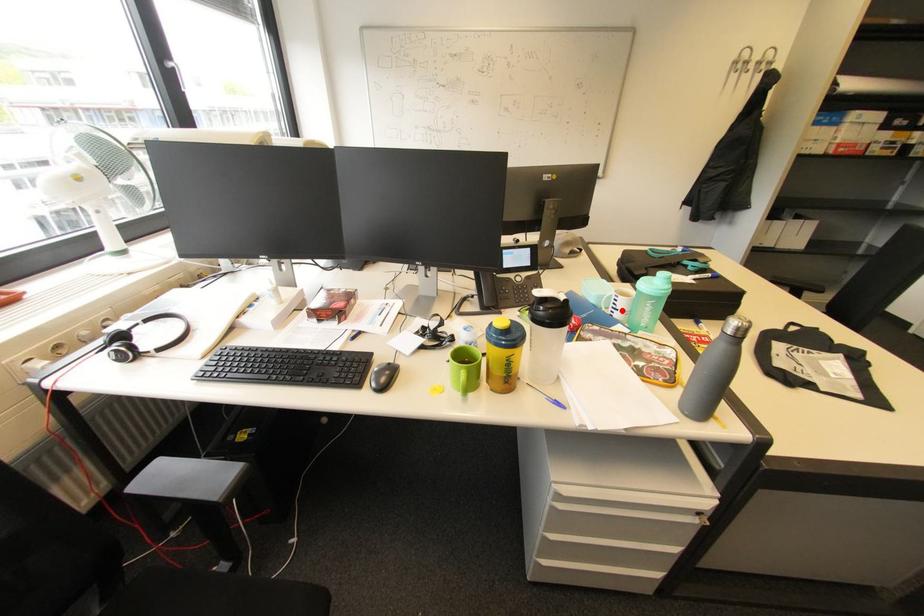
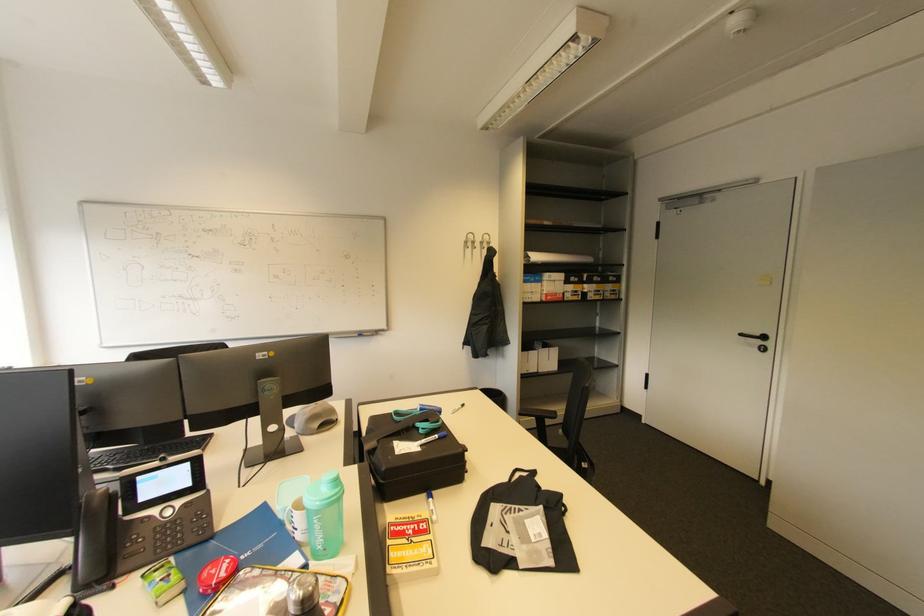
Where in the second image is the point corresponding to the highlighted location from the first image?

(300, 531)